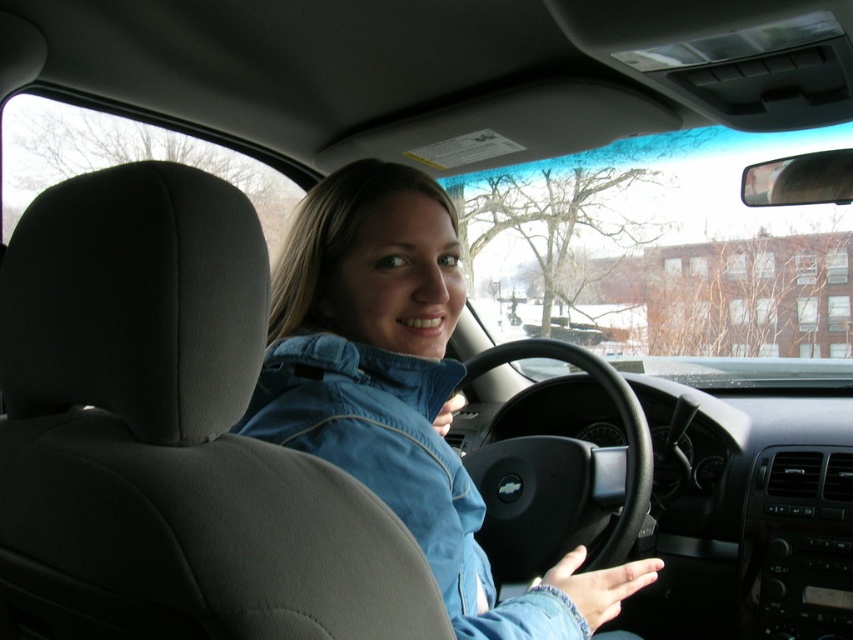
Question: Can you confirm if blue denim jacket at upper center is thinner than denim jacket at center?

Choices:
 (A) yes
 (B) no

Answer: (A)

Question: Estimate the real-world distances between objects in this image. Which object is closer to the blue denim jacket at upper center?

Choices:
 (A) denim jacket at center
 (B) black leather steering wheel at center

Answer: (A)

Question: Among these points, which one is farthest from the camera?

Choices:
 (A) (358, 410)
 (B) (500, 528)
 (C) (86, 358)

Answer: (B)

Question: Which of the following is the farthest from the observer?

Choices:
 (A) blue denim jacket at upper center
 (B) black leather steering wheel at center

Answer: (B)

Question: Does blue denim jacket at upper center appear on the left side of denim jacket at center?

Choices:
 (A) yes
 (B) no

Answer: (A)

Question: Does blue denim jacket at upper center appear on the right side of black leather steering wheel at center?

Choices:
 (A) yes
 (B) no

Answer: (B)